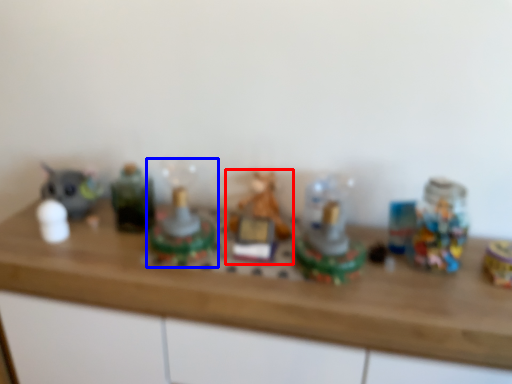
Question: Which of the following is the closest to the observer, toy (highlighted by a red box) or toy (highlighted by a blue box)?

Choices:
 (A) toy
 (B) toy

Answer: (B)